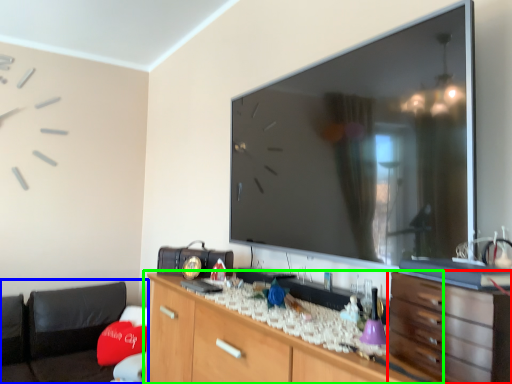
Question: Based on their relative distances, which object is farther from chest of drawers (highlighted by a red box)? Choose from bean bag chair (highlighted by a blue box) and cabinetry (highlighted by a green box).

Choices:
 (A) bean bag chair
 (B) cabinetry

Answer: (A)